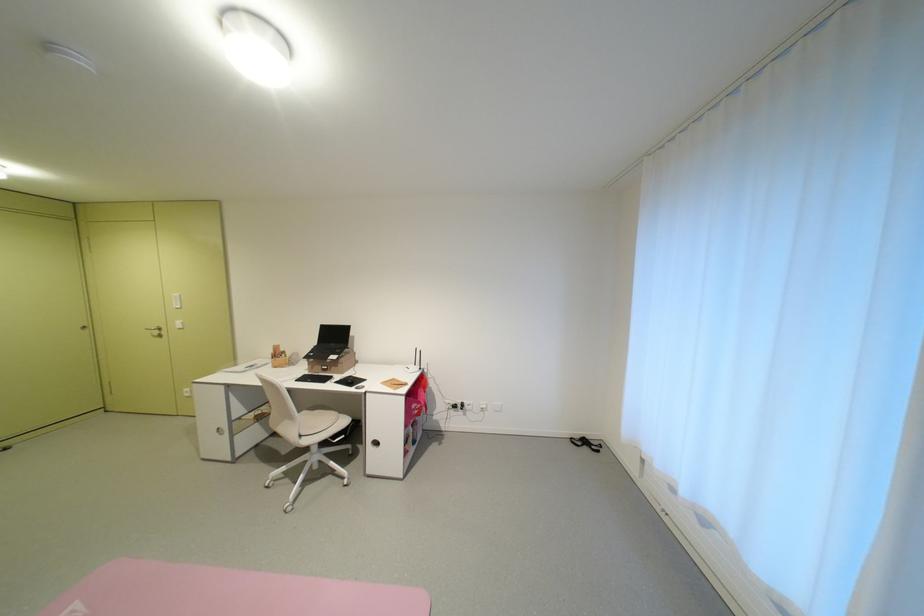
Image resolution: width=924 pixels, height=616 pixels. Describe the element at coordinates (306, 424) in the screenshot. I see `the chair sitting surface` at that location.